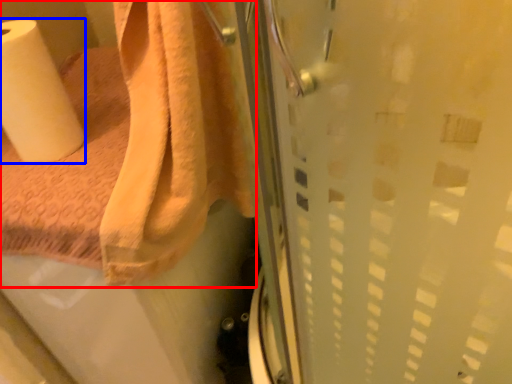
Question: Which object appears farthest to the camera in this image, towel (highlighted by a red box) or paper towel (highlighted by a blue box)?

Choices:
 (A) towel
 (B) paper towel

Answer: (B)